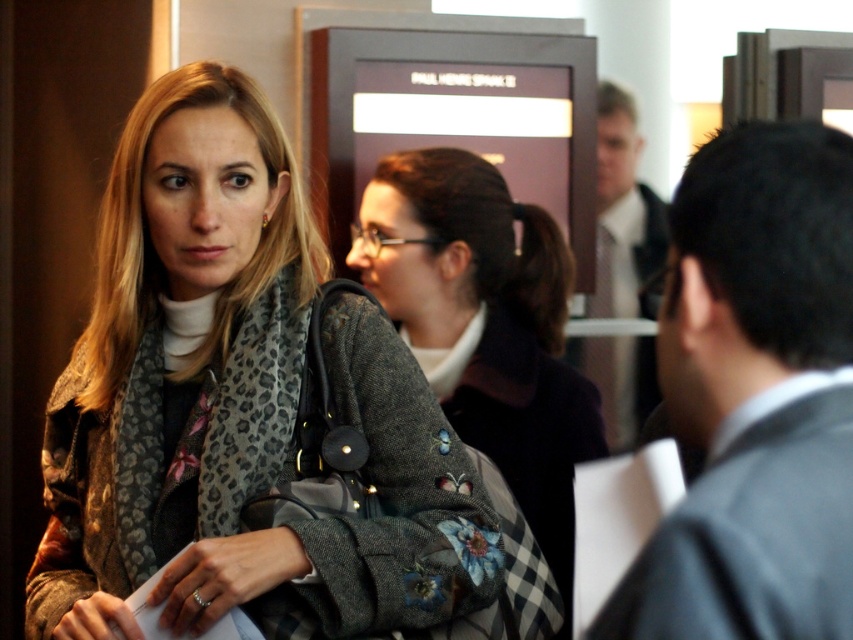
How much distance is there between leopard print coat at center and light brown suit at upper right?

5.87 feet

Is leopard print coat at center further to the viewer compared to light brown suit at upper right?

That is False.

Who is more distant from viewer, (x=412, y=529) or (x=596, y=240)?

The point (x=596, y=240) is behind.

Image resolution: width=853 pixels, height=640 pixels. In order to click on leopard print coat at center in this screenshot , I will do `click(236, 401)`.

Does floral tweed coat at center lie in front of light brown suit at upper right?

Yes, it is.

Between floral tweed coat at center and light brown suit at upper right, which one is positioned lower?

floral tweed coat at center is lower down.

Is point (582, 381) less distant than point (608, 355)?

Yes, it is in front of point (608, 355).

Locate an element on the screen. The image size is (853, 640). floral tweed coat at center is located at coordinates tap(485, 326).

Can you confirm if leopard print coat at center is shorter than floral tweed coat at center?

Indeed, leopard print coat at center has a lesser height compared to floral tweed coat at center.

Measure the distance between point (132, 131) and camera.

Point (132, 131) and camera are 6.84 feet apart.

The width and height of the screenshot is (853, 640). I want to click on leopard print coat at center, so click(x=236, y=401).

This screenshot has height=640, width=853. Find the location of `leopard print coat at center`. leopard print coat at center is located at coordinates (236, 401).